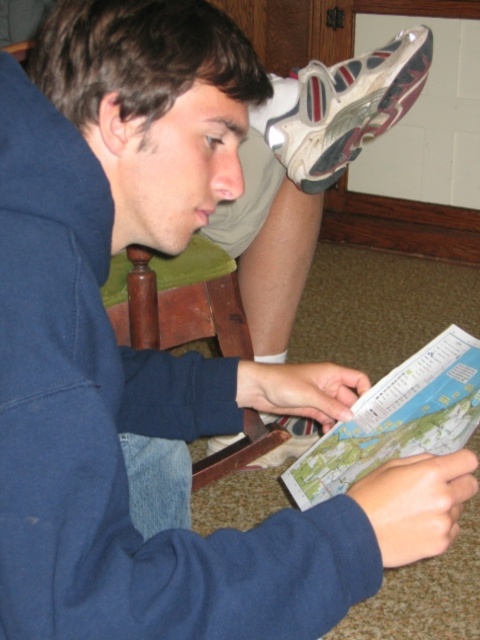
You are a shoe designer observing the image. You need to determine which shoe has a wider width between the white mesh shoe at upper right and the white leather shoe at lower center. Which one is wider?

The white mesh shoe at upper right is wider than the white leather shoe at lower center according to the description.

You are a physical therapist observing a patient sitting on a chair. The patient is wearing a white mesh shoe at upper right and a white leather shoe at lower center. Which shoe is higher up on the patient?

The white mesh shoe at upper right is positioned over the white leather shoe at lower center, so it is higher up on the patient.

You are trying to decide which shoe to wear for a short walk. You see the white mesh shoe at upper right and the white leather shoe at lower center in the image. Which one is located to the right of the other?

The white mesh shoe at upper right is positioned on the right side of the white leather shoe at lower center.